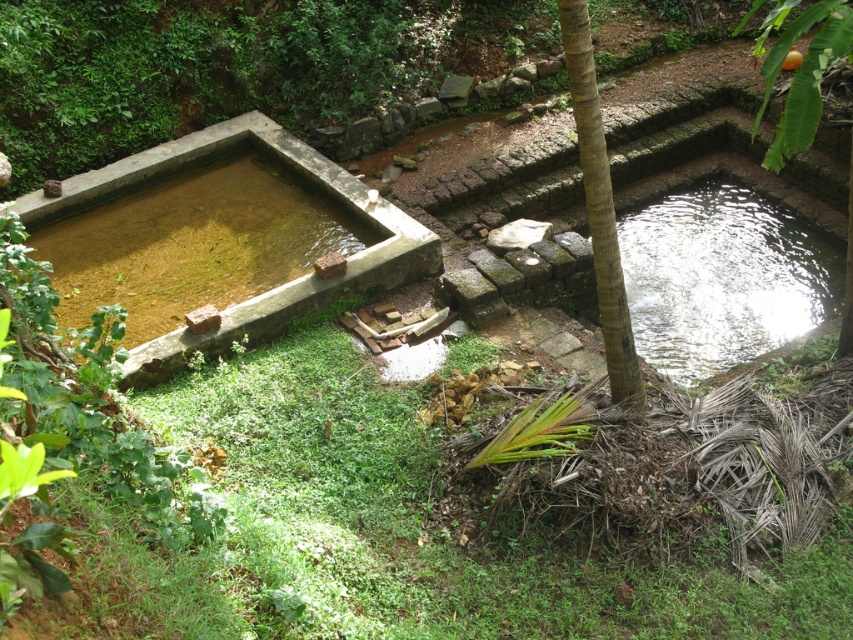
Question: Which point is farther to the camera?

Choices:
 (A) brown rough tree trunk at center
 (B) green grass at center

Answer: (A)

Question: Does green grass at center appear on the right side of brown rough tree trunk at center?

Choices:
 (A) no
 (B) yes

Answer: (A)

Question: Does green grass at center have a smaller size compared to brown rough tree trunk at center?

Choices:
 (A) yes
 (B) no

Answer: (B)

Question: Considering the relative positions of green grass at center and brown rough tree trunk at center in the image provided, where is green grass at center located with respect to brown rough tree trunk at center?

Choices:
 (A) right
 (B) left

Answer: (B)